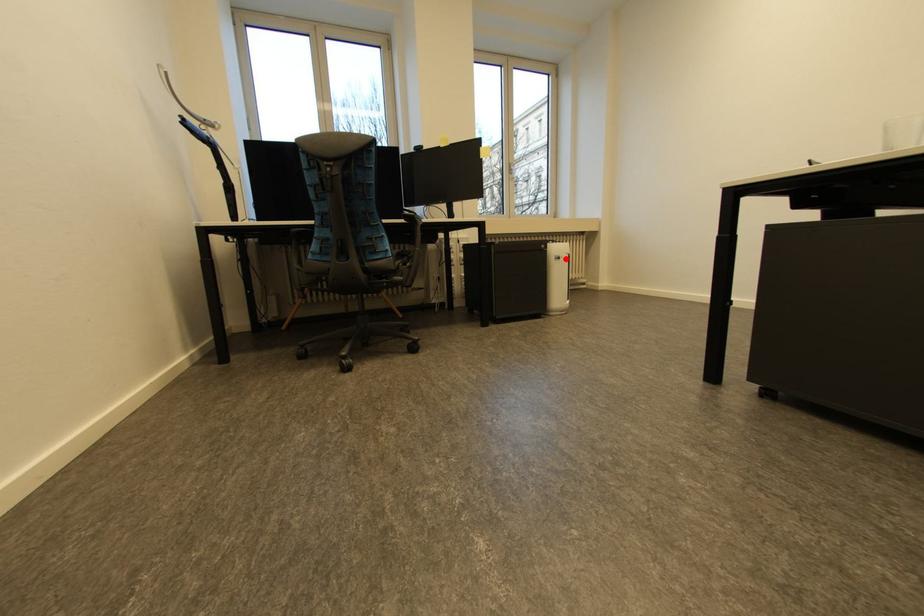
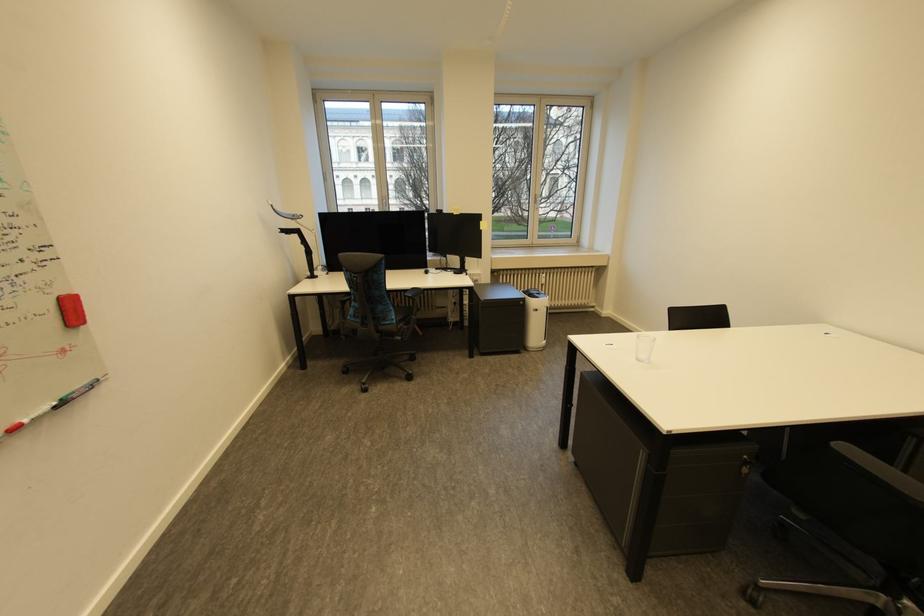
Where in the second image is the point corresponding to the highlighted location from the first image?

(543, 310)